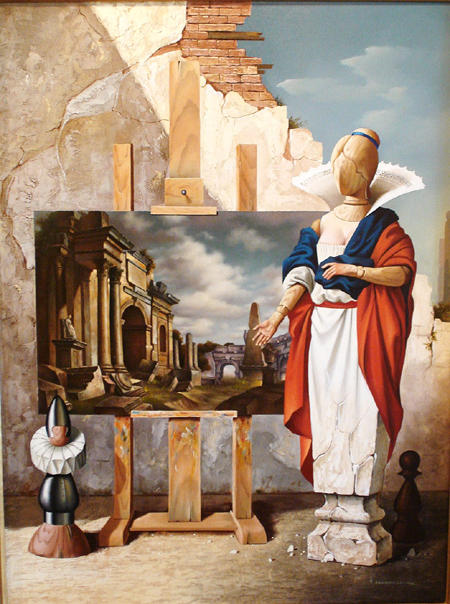
Where is `painting of a building`? Image resolution: width=450 pixels, height=604 pixels. painting of a building is located at coordinates (124, 289).